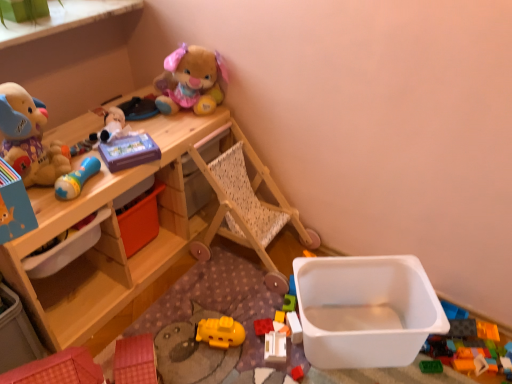
This screenshot has width=512, height=384. Find the location of `spots to the right of translucent plastic blocks at center, the 3th toy when ordered from bottom to top`. spots to the right of translucent plastic blocks at center, the 3th toy when ordered from bottom to top is located at coordinates (338, 330).